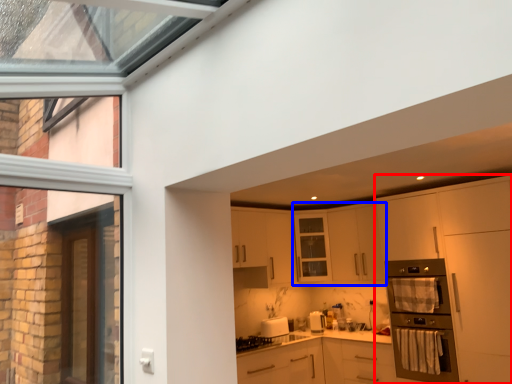
Question: Which point is further to the camera, cabinetry (highlighted by a red box) or cabinetry (highlighted by a blue box)?

Choices:
 (A) cabinetry
 (B) cabinetry

Answer: (B)